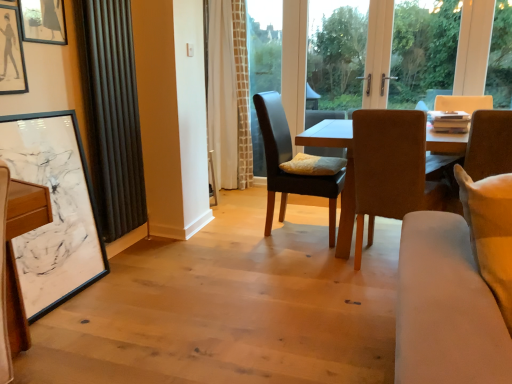
Question: From a real-world perspective, is brown leather chair at right, the 1th chair viewed from the right, below white textured curtain at center, which is counted as the first curtain, starting from the back?

Choices:
 (A) yes
 (B) no

Answer: (A)

Question: Is white textured curtain at center, the first curtain positioned from the right, completely or partially inside brown leather chair at right, the third chair viewed from the left?

Choices:
 (A) yes
 (B) no

Answer: (B)

Question: Can you confirm if brown leather chair at right, the third chair viewed from the left, is thinner than white textured curtain at center, the first curtain positioned from the right?

Choices:
 (A) yes
 (B) no

Answer: (B)

Question: Does brown leather chair at right, the third chair viewed from the left, touch white textured curtain at center, the 2th curtain when ordered from left to right?

Choices:
 (A) no
 (B) yes

Answer: (A)

Question: From a real-world perspective, is brown leather chair at right, the 1th chair viewed from the right, on white textured curtain at center, which is counted as the first curtain, starting from the back?

Choices:
 (A) no
 (B) yes

Answer: (A)

Question: Is brown leather chair at right, the 1th chair viewed from the right, not inside white textured curtain at center, which is counted as the second curtain, starting from the front?

Choices:
 (A) no
 (B) yes

Answer: (B)

Question: Does soft yellow pillow at center have a greater width compared to black matte picture frame at upper left, placed as the 2th picture frame when sorted from top to bottom?

Choices:
 (A) yes
 (B) no

Answer: (A)

Question: From a real-world perspective, is soft yellow pillow at center located higher than black matte picture frame at upper left, placed as the 2th picture frame when sorted from top to bottom?

Choices:
 (A) yes
 (B) no

Answer: (B)

Question: Is soft yellow pillow at center oriented towards black matte picture frame at upper left, marked as the 2th picture frame in a bottom-to-top arrangement?

Choices:
 (A) yes
 (B) no

Answer: (B)

Question: Is black matte picture frame at upper left, placed as the 2th picture frame when sorted from top to bottom, located within soft yellow pillow at center?

Choices:
 (A) yes
 (B) no

Answer: (B)

Question: Are soft yellow pillow at center and black matte picture frame at upper left, marked as the 2th picture frame in a bottom-to-top arrangement, located far from each other?

Choices:
 (A) yes
 (B) no

Answer: (A)

Question: Considering the relative positions of soft yellow pillow at center and black matte picture frame at upper left, placed as the 2th picture frame when sorted from top to bottom, in the image provided, is soft yellow pillow at center to the right of black matte picture frame at upper left, placed as the 2th picture frame when sorted from top to bottom, from the viewer's perspective?

Choices:
 (A) no
 (B) yes

Answer: (B)

Question: Is leather cushioned chair at center, which appears as the third chair when viewed from the right, outside of light beige fabric couch at lower right?

Choices:
 (A) no
 (B) yes

Answer: (B)